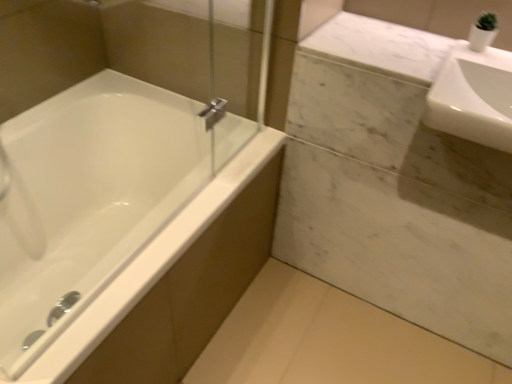
Question: From the image's perspective, does white glossy sink at upper right appear lower than white glossy bathtub at left?

Choices:
 (A) yes
 (B) no

Answer: (B)

Question: Is white glossy sink at upper right aimed at white glossy bathtub at left?

Choices:
 (A) no
 (B) yes

Answer: (A)

Question: Considering the relative sizes of white glossy sink at upper right and white glossy bathtub at left in the image provided, is white glossy sink at upper right taller than white glossy bathtub at left?

Choices:
 (A) no
 (B) yes

Answer: (A)

Question: Is white glossy sink at upper right to the left of white glossy bathtub at left from the viewer's perspective?

Choices:
 (A) yes
 (B) no

Answer: (B)

Question: From a real-world perspective, is white glossy sink at upper right on white glossy bathtub at left?

Choices:
 (A) no
 (B) yes

Answer: (B)

Question: From a real-world perspective, is white glossy sink at upper right positioned under white glossy bathtub at left based on gravity?

Choices:
 (A) yes
 (B) no

Answer: (B)

Question: Does white glossy bathtub at left have a greater width compared to white glossy sink at upper right?

Choices:
 (A) no
 (B) yes

Answer: (B)

Question: Is white glossy bathtub at left not near white glossy sink at upper right?

Choices:
 (A) no
 (B) yes

Answer: (A)

Question: Can you see white glossy bathtub at left touching white glossy sink at upper right?

Choices:
 (A) yes
 (B) no

Answer: (B)

Question: Can white glossy sink at upper right be found inside white glossy bathtub at left?

Choices:
 (A) no
 (B) yes

Answer: (A)

Question: Is white glossy bathtub at left looking in the opposite direction of white glossy sink at upper right?

Choices:
 (A) yes
 (B) no

Answer: (B)

Question: Does white glossy bathtub at left have a lesser width compared to white glossy sink at upper right?

Choices:
 (A) yes
 (B) no

Answer: (B)

Question: From their relative heights in the image, would you say white glossy sink at upper right is taller or shorter than white glossy bathtub at left?

Choices:
 (A) short
 (B) tall

Answer: (A)